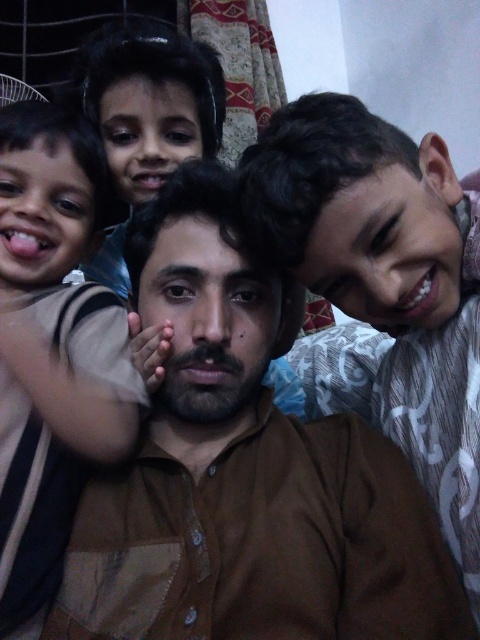
Question: Is brown cotton shirt at center behind brown striped shirt at left?

Choices:
 (A) yes
 (B) no

Answer: (B)

Question: Is the position of brown cotton shirt at center more distant than that of brown striped shirt at left?

Choices:
 (A) no
 (B) yes

Answer: (A)

Question: Can you confirm if brown cotton shirt at center is thinner than brown striped shirt at left?

Choices:
 (A) yes
 (B) no

Answer: (B)

Question: Which object is farther from the camera taking this photo?

Choices:
 (A) brown striped shirt at left
 (B) brown cotton shirt at center

Answer: (A)